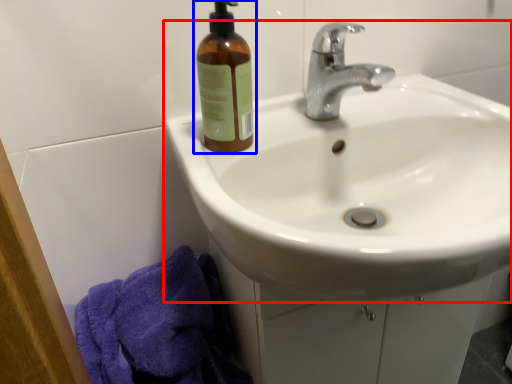
Question: Which of the following is the farthest to the observer, sink (highlighted by a red box) or bottle (highlighted by a blue box)?

Choices:
 (A) sink
 (B) bottle

Answer: (B)